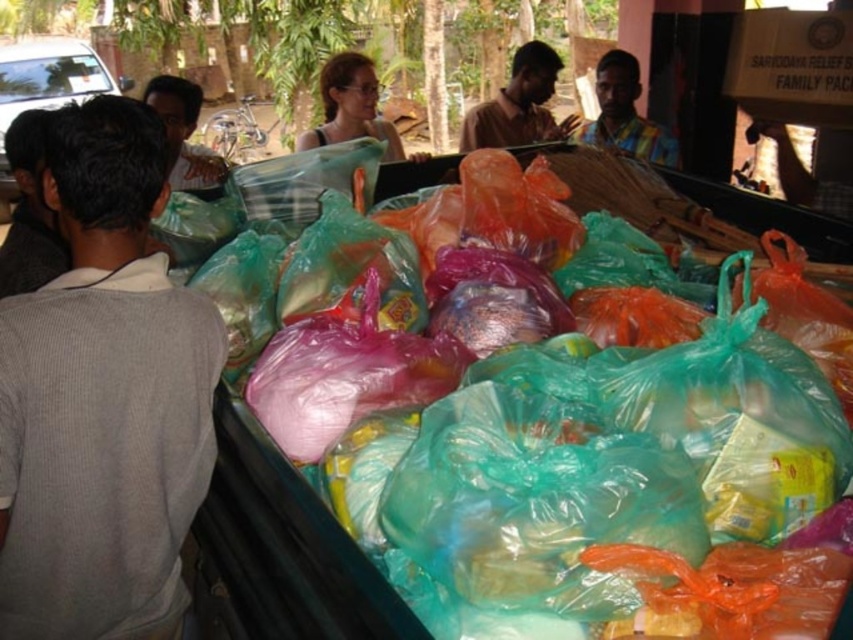
Question: Does gray cotton shirt at left have a lesser width compared to brown matte shirt at upper center?

Choices:
 (A) no
 (B) yes

Answer: (B)

Question: Can you confirm if gray cotton shirt at left is smaller than multicolored fabric shirt at center?

Choices:
 (A) no
 (B) yes

Answer: (B)

Question: Which object is farther from the camera taking this photo?

Choices:
 (A) brown matte shirt at upper center
 (B) translucent plastic bags at center
 (C) matte black shirt at upper left
 (D) gray cotton shirt at left

Answer: (A)

Question: Which object appears farthest from the camera in this image?

Choices:
 (A) brown matte shirt at upper center
 (B) translucent plastic bags at center
 (C) multicolored fabric shirt at center
 (D) gray cotton shirt at left

Answer: (A)

Question: Among these objects, which one is farthest from the camera?

Choices:
 (A) multicolored fabric shirt at center
 (B) brown matte shirt at upper center

Answer: (B)

Question: Can you confirm if multicolored fabric shirt at center is positioned above matte black shirt at upper left?

Choices:
 (A) no
 (B) yes

Answer: (B)